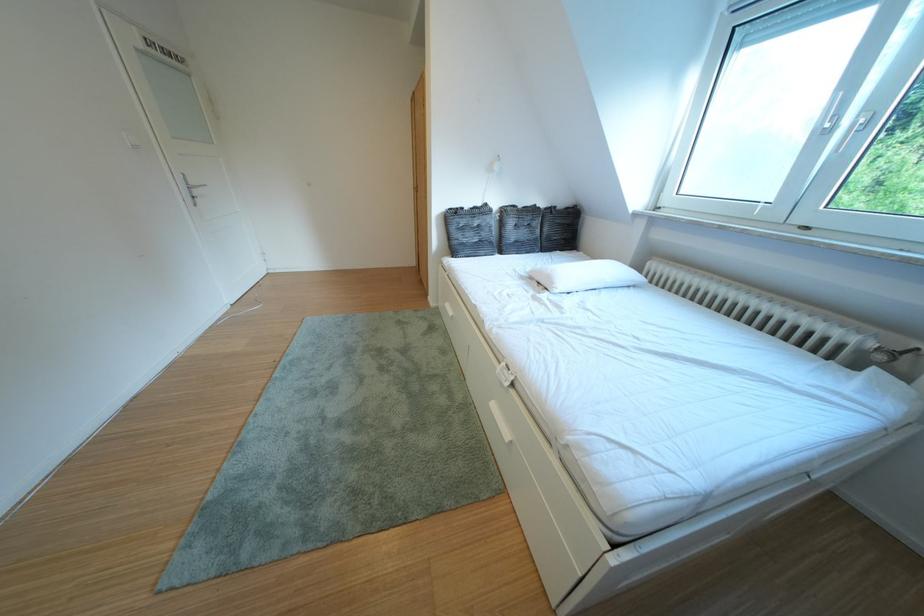
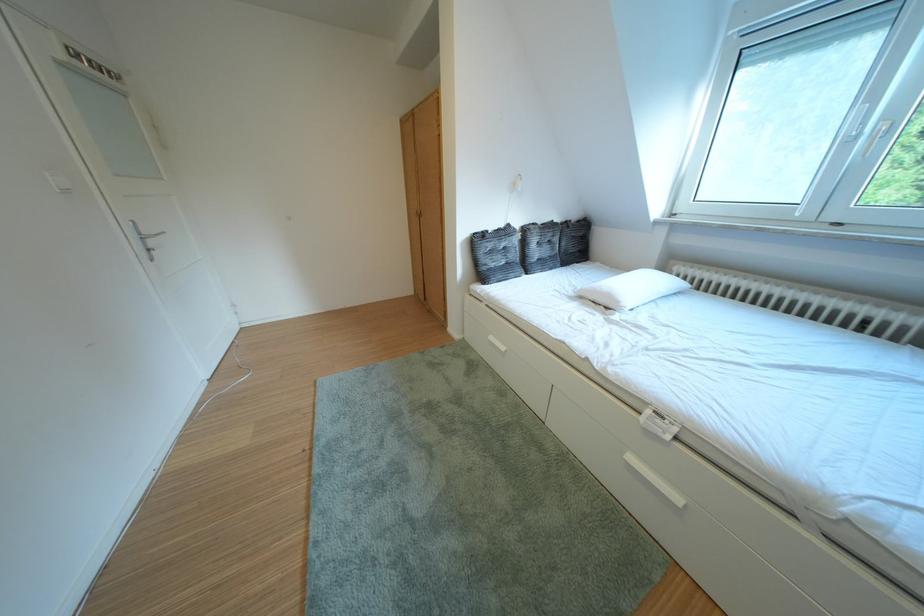
Find the pixel in the second image that matches (476,214) in the first image.

(500, 237)